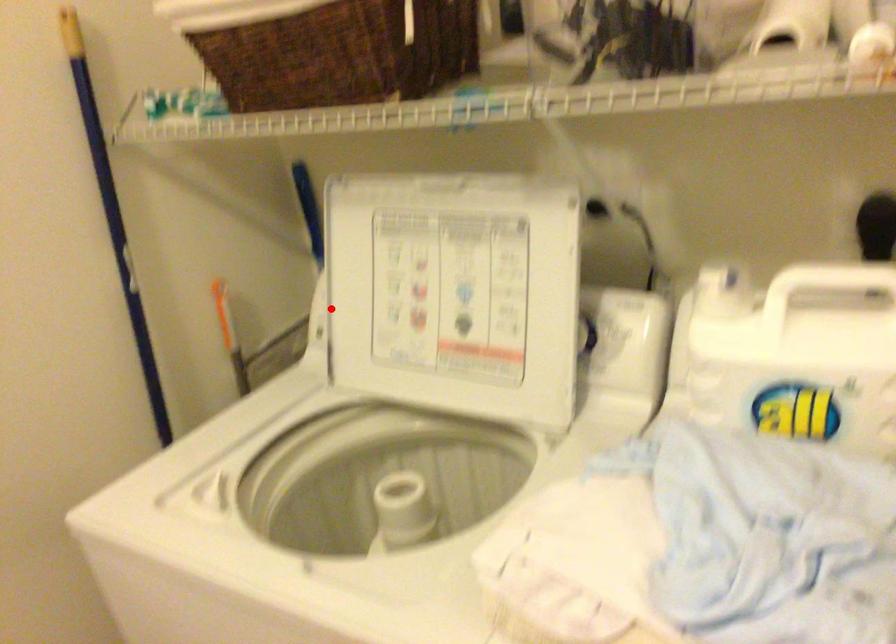
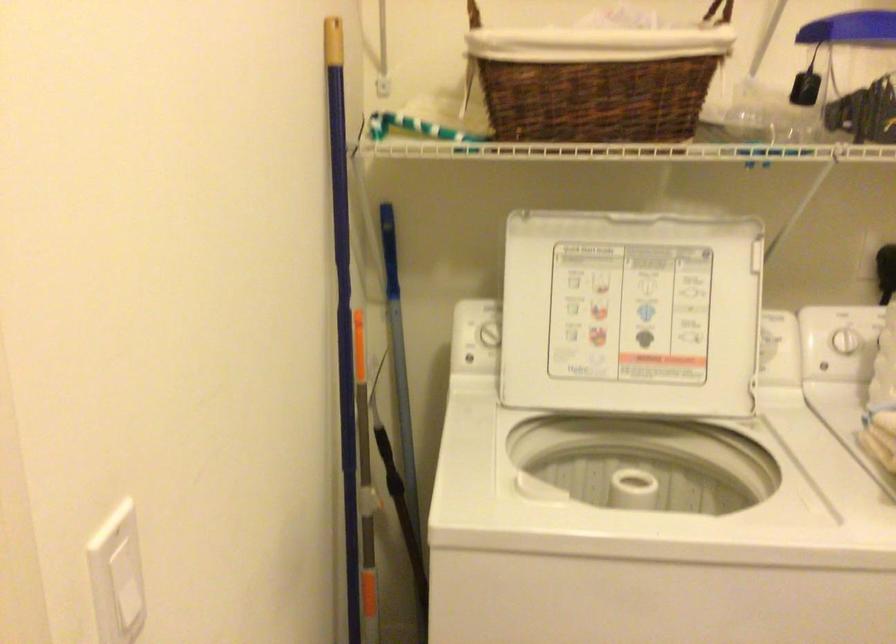
Question: I am providing you with two images of the same scene from different viewpoints. A red point is marked on the first image. Can you still see the location of the red point in image 2?

Choices:
 (A) Yes
 (B) No

Answer: (A)